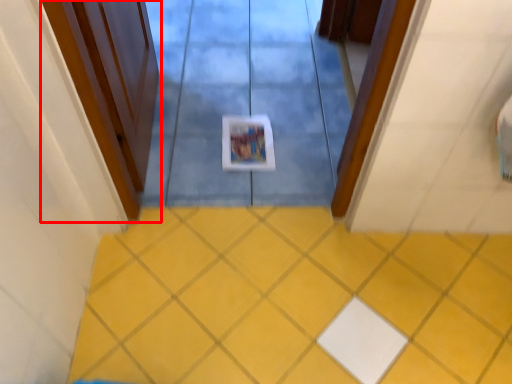
Question: From the image's perspective, what is the correct spatial positioning of door (annotated by the red box) in reference to ceramic tile?

Choices:
 (A) below
 (B) above

Answer: (B)